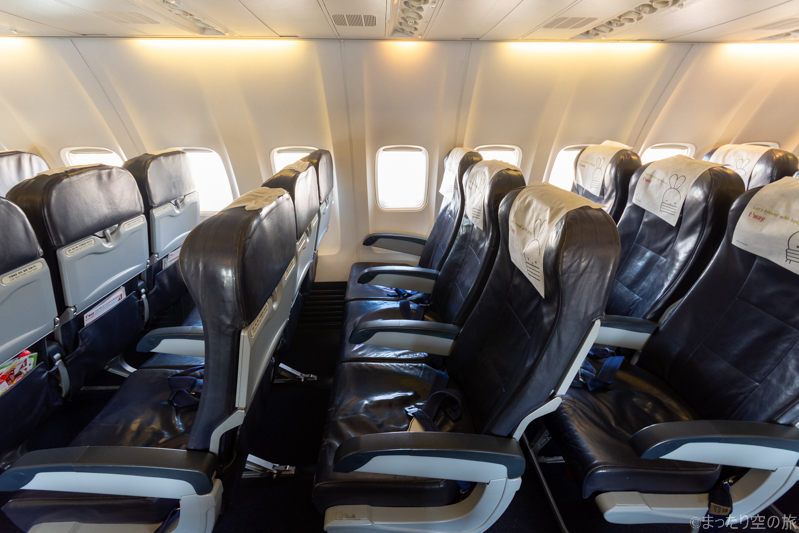
You are a GUI agent. You are given a task and a screenshot of the screen. Output one action in this format:
    pyautogui.click(x=<x>, y=<y>)
    Task: Click on the tray tables
    
    Given the screenshot: What is the action you would take?
    (x=34, y=288), (x=121, y=259), (x=177, y=216), (x=256, y=344), (x=309, y=256), (x=326, y=225)